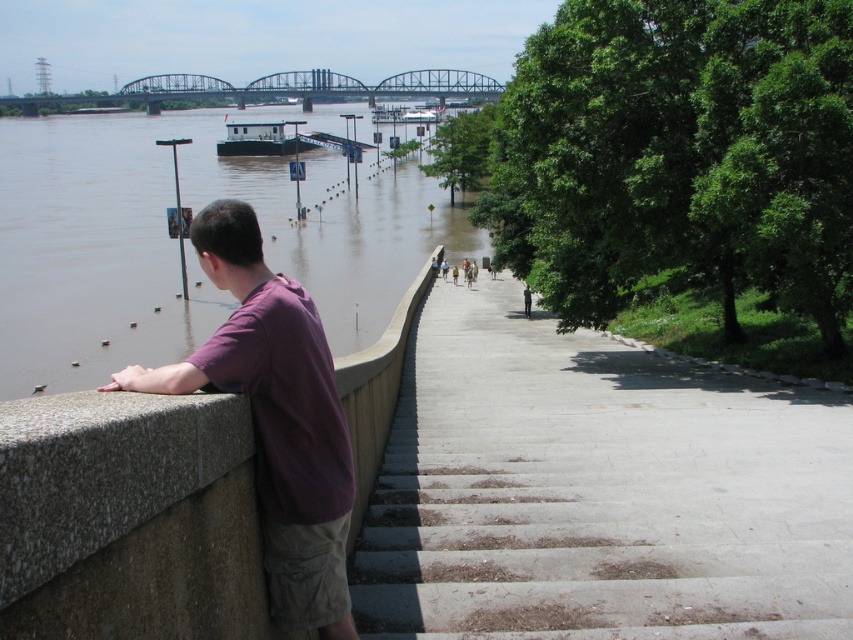
Which is behind, point (13, 339) or point (480, 90)?

The point (480, 90) is more distant.

Is point (39, 134) closer to viewer compared to point (334, 74)?

Yes, point (39, 134) is closer to viewer.

This screenshot has height=640, width=853. I want to click on brown muddy water at left, so click(186, 241).

Can you confirm if brown muddy water at left is positioned to the left of purple cotton shirt at left?

Yes, brown muddy water at left is to the left of purple cotton shirt at left.

Between point (86, 180) and point (242, 234), which one is positioned behind?

The point (86, 180) is behind.

Does point (322, 312) come in front of point (267, 547)?

No.

Where is `brown muddy water at left`? Image resolution: width=853 pixels, height=640 pixels. brown muddy water at left is located at coordinates (186, 241).

Does purple cotton shirt at left appear under brushed metal bridge at upper center?

Yes, purple cotton shirt at left is below brushed metal bridge at upper center.

Based on the photo, can you confirm if purple cotton shirt at left is positioned to the left of brushed metal bridge at upper center?

Incorrect, purple cotton shirt at left is not on the left side of brushed metal bridge at upper center.

Is point (253, 275) farther from viewer compared to point (187, 84)?

No, it is in front of (187, 84).

Where is `purple cotton shirt at left`? This screenshot has width=853, height=640. purple cotton shirt at left is located at coordinates (276, 417).